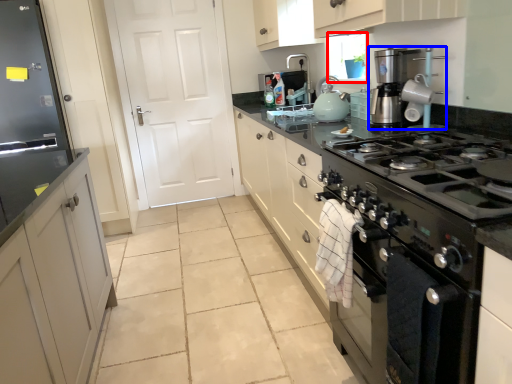
Question: Among these objects, which one is nearest to the camera, window screen (highlighted by a red box) or home appliance (highlighted by a blue box)?

Choices:
 (A) window screen
 (B) home appliance

Answer: (B)